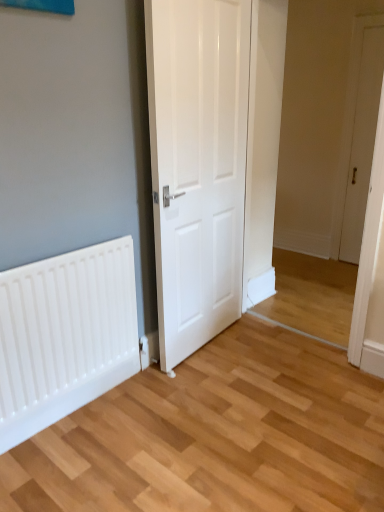
You are a GUI agent. You are given a task and a screenshot of the screen. Output one action in this format:
    pyautogui.click(x=<x>, y=<y>)
    Task: Click on the white matte radiator at lower left
    The image size is (384, 512).
    Given the screenshot: What is the action you would take?
    point(65,335)

At what (x,y) coordinates should I click in order to perform the action: click on white wooden door at right, the 1th door viewed from the right. Please return your answer as a coordinate pair (x, y). This screenshot has width=384, height=512. Looking at the image, I should click on 362,142.

Is white glossy door at center, the second door positioned from the right, bigger or smaller than white wooden door at right, the second door from the front?

In the image, white glossy door at center, the second door positioned from the right, appears to be larger than white wooden door at right, the second door from the front.

Which of these two, white glossy door at center, the 2th door in the back-to-front sequence, or white wooden door at right, the second door from the front, stands taller?

With more height is white wooden door at right, the second door from the front.

From the picture: How distant is white glossy door at center, the second door positioned from the right, from white wooden door at right, positioned as the first door in back-to-front order?

The distance of white glossy door at center, the second door positioned from the right, from white wooden door at right, positioned as the first door in back-to-front order, is 5.84 feet.

Can you confirm if white glossy door at center, the 2th door in the back-to-front sequence, is positioned to the right of white wooden door at right, which ranks as the second door in left-to-right order?

No, white glossy door at center, the 2th door in the back-to-front sequence, is not to the right of white wooden door at right, which ranks as the second door in left-to-right order.

Between white matte radiator at lower left and white glossy door at center, positioned as the first door in front-to-back order, which one has smaller width?

With smaller width is white matte radiator at lower left.

Is white matte radiator at lower left turned away from white glossy door at center, the second door positioned from the right?

white matte radiator at lower left is not turned away from white glossy door at center, the second door positioned from the right.

Identify the location of radiator that is below the white glossy door at center, the 1th door positioned from the left (from the image's perspective). (65, 335).

Is white matte radiator at lower left far from white glossy door at center, positioned as the first door in front-to-back order?

white matte radiator at lower left is actually quite close to white glossy door at center, positioned as the first door in front-to-back order.

You are a GUI agent. You are given a task and a screenshot of the screen. Output one action in this format:
    pyautogui.click(x=<x>, y=<y>)
    Task: Click on the door below the white wooden door at right, the 1th door viewed from the right (from a real-world perspective)
    The height and width of the screenshot is (512, 384).
    Given the screenshot: What is the action you would take?
    pyautogui.click(x=197, y=165)

Would you say white wooden door at right, the 1th door viewed from the right, contains white glossy door at center, the second door positioned from the right?

No, white glossy door at center, the second door positioned from the right, is located outside of white wooden door at right, the 1th door viewed from the right.

From the image's perspective, which one is positioned higher, white wooden door at right, the second door from the front, or white glossy door at center, the 1th door positioned from the left?

From the image's view, white wooden door at right, the second door from the front, is above.

How many degrees apart are the facing directions of white wooden door at right, the second door from the front, and white glossy door at center, the 1th door positioned from the left?

95.4 degrees.

Could you measure the distance between white wooden door at right, the second door from the front, and white matte radiator at lower left?

white wooden door at right, the second door from the front, is 2.72 meters from white matte radiator at lower left.

Considering the relative sizes of white wooden door at right, which ranks as the second door in left-to-right order, and white matte radiator at lower left in the image provided, is white wooden door at right, which ranks as the second door in left-to-right order, bigger than white matte radiator at lower left?

Indeed, white wooden door at right, which ranks as the second door in left-to-right order, has a larger size compared to white matte radiator at lower left.

In terms of height, does white wooden door at right, the second door from the front, look taller or shorter compared to white matte radiator at lower left?

Clearly, white wooden door at right, the second door from the front, is taller compared to white matte radiator at lower left.

Is white wooden door at right, the second door from the front, at the left side of white matte radiator at lower left?

No, white wooden door at right, the second door from the front, is not to the left of white matte radiator at lower left.

Between white glossy door at center, the second door positioned from the right, and white matte radiator at lower left, which one has smaller width?

white matte radiator at lower left.

From a real-world perspective, which object stands above the other?

white glossy door at center, the 1th door positioned from the left, from a real-world perspective.

From the image's perspective, relative to white matte radiator at lower left, is white glossy door at center, the 1th door positioned from the left, above or below?

Based on their image positions, white glossy door at center, the 1th door positioned from the left, is located above white matte radiator at lower left.

Who is bigger, white glossy door at center, the 1th door positioned from the left, or white matte radiator at lower left?

white glossy door at center, the 1th door positioned from the left, is bigger.

Considering the sizes of objects white matte radiator at lower left and white wooden door at right, the 1th door viewed from the right, in the image provided, who is wider, white matte radiator at lower left or white wooden door at right, the 1th door viewed from the right,?

white wooden door at right, the 1th door viewed from the right.

Identify the location of the 2nd door above when counting from the white matte radiator at lower left (from the image's perspective). This screenshot has width=384, height=512. (362, 142).

From a real-world perspective, which is physically below, white matte radiator at lower left or white wooden door at right, the 1th door viewed from the right?

From a 3D spatial view, white matte radiator at lower left is below.

Could you tell me if white matte radiator at lower left is turned towards white wooden door at right, the second door from the front?

No.

Find the location of a particular element. door located above the white glossy door at center, the second door positioned from the right (from a real-world perspective) is located at coordinates (362, 142).

Locate an element on the screen. the 1st door counting from the right side of the white matte radiator at lower left is located at coordinates 197,165.

Based on the photo, considering their positions, is white glossy door at center, the second door positioned from the right, positioned closer to white matte radiator at lower left than white wooden door at right, positioned as the first door in back-to-front order?

Based on the image, white glossy door at center, the second door positioned from the right, appears to be nearer to white matte radiator at lower left.

Which object lies further to the anchor point white glossy door at center, the second door positioned from the right, white matte radiator at lower left or white wooden door at right, the second door from the front?

Among the two, white wooden door at right, the second door from the front, is located further to white glossy door at center, the second door positioned from the right.

Considering their positions, is white wooden door at right, positioned as the first door in back-to-front order, positioned closer to white matte radiator at lower left than white glossy door at center, the second door positioned from the right?

white glossy door at center, the second door positioned from the right, lies closer to white matte radiator at lower left than the other object.

Based on their spatial positions, is white glossy door at center, the 1th door positioned from the left, or white matte radiator at lower left further from white wooden door at right, the 1th door viewed from the right?

The object further to white wooden door at right, the 1th door viewed from the right, is white matte radiator at lower left.

From the image, which object appears to be farther from white glossy door at center, the 1th door positioned from the left, white wooden door at right, which ranks as the second door in left-to-right order, or white matte radiator at lower left?

Among the two, white wooden door at right, which ranks as the second door in left-to-right order, is located further to white glossy door at center, the 1th door positioned from the left.

Considering their positions, is white matte radiator at lower left positioned closer to white wooden door at right, which ranks as the second door in left-to-right order, than white glossy door at center, positioned as the first door in front-to-back order?

Among the two, white glossy door at center, positioned as the first door in front-to-back order, is located nearer to white wooden door at right, which ranks as the second door in left-to-right order.

At what (x,y) coordinates should I click in order to perform the action: click on door located between white matte radiator at lower left and white wooden door at right, the 1th door viewed from the right, in the left-right direction. Please return your answer as a coordinate pair (x, y). This screenshot has width=384, height=512. Looking at the image, I should click on (197, 165).